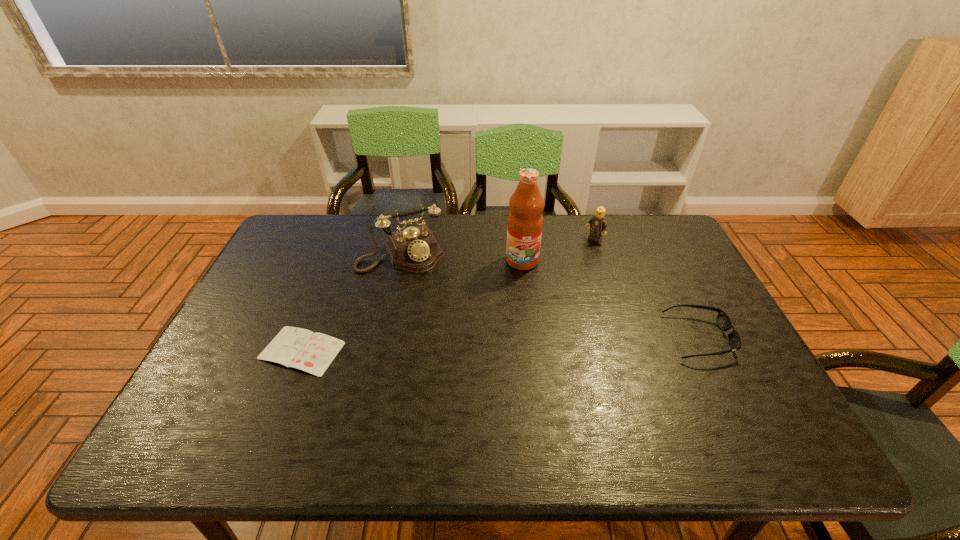
I want to click on the shortest object, so click(298, 348).

This screenshot has height=540, width=960. In order to click on sunglasses in this screenshot , I will do `click(724, 323)`.

The image size is (960, 540). What are the coordinates of `the second shortest object` in the screenshot? It's located at (724, 323).

The height and width of the screenshot is (540, 960). Find the location of `the third object from right to left`. the third object from right to left is located at coordinates (525, 222).

You are a GUI agent. You are given a task and a screenshot of the screen. Output one action in this format:
    pyautogui.click(x=<x>, y=<y>)
    Task: Click on the fruit juice
    
    Given the screenshot: What is the action you would take?
    pyautogui.click(x=525, y=222)

Where is `the fourth shortest object`? the fourth shortest object is located at coordinates (414, 249).

This screenshot has width=960, height=540. Identify the location of the fourth object from left to right. (598, 222).

Where is `the third tallest object`? the third tallest object is located at coordinates (598, 222).

At what (x,y) coordinates should I click in order to perform the action: click on vacant space positioned on the back of the shortest object. Please return your answer as a coordinate pair (x, y). This screenshot has height=540, width=960. Looking at the image, I should click on (341, 249).

Where is `free space located 0.180m on the front label of the third object from left to right`? The height and width of the screenshot is (540, 960). free space located 0.180m on the front label of the third object from left to right is located at coordinates pyautogui.click(x=523, y=314).